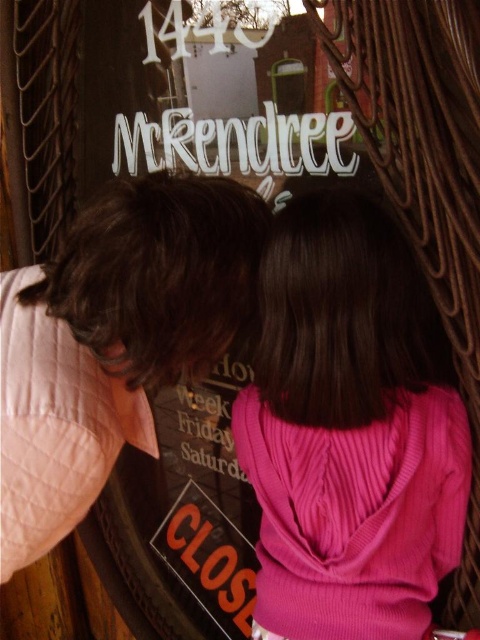
Who is lower down, pink ribbed sweater at center or pink sweater at center?

pink ribbed sweater at center

Is pink ribbed sweater at center thinner than pink sweater at center?

Indeed, pink ribbed sweater at center has a lesser width compared to pink sweater at center.

Locate an element on the screen. The width and height of the screenshot is (480, 640). pink ribbed sweater at center is located at coordinates (349, 429).